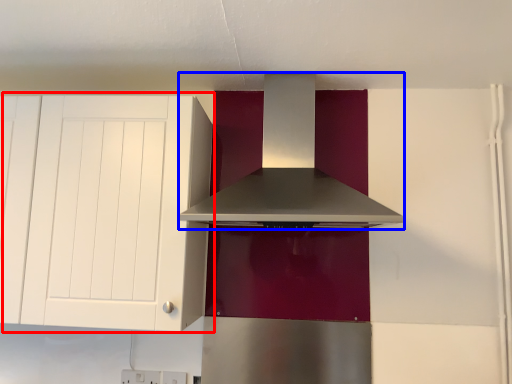
Question: Which object appears closest to the camera in this image, cabinetry (highlighted by a red box) or home appliance (highlighted by a blue box)?

Choices:
 (A) cabinetry
 (B) home appliance

Answer: (B)